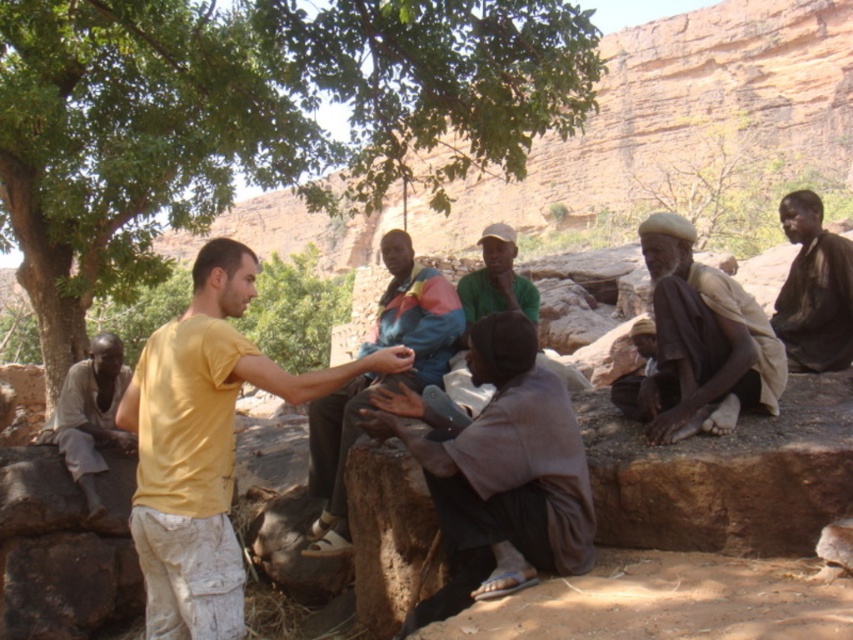
Is multicolored fabric at center thinner than dark brown fabric at right?

Incorrect, multicolored fabric at center's width is not less than dark brown fabric at right's.

In order to click on multicolored fabric at center in this screenshot , I will do `click(379, 378)`.

Is brown woven cloth at lower right to the left of green fabric cap at center from the viewer's perspective?

No, brown woven cloth at lower right is not to the left of green fabric cap at center.

Can you confirm if brown woven cloth at lower right is thinner than green fabric cap at center?

In fact, brown woven cloth at lower right might be wider than green fabric cap at center.

Where is `brown woven cloth at lower right`? This screenshot has height=640, width=853. brown woven cloth at lower right is located at coordinates (701, 340).

The height and width of the screenshot is (640, 853). I want to click on brown woven cloth at lower right, so (x=701, y=340).

Between green leafy tree at upper left and multicolored fabric at center, which one is positioned higher?

Positioned higher is green leafy tree at upper left.

Which of these two, green leafy tree at upper left or multicolored fabric at center, stands shorter?

With less height is multicolored fabric at center.

Which is behind, point (47, 68) or point (310, 556)?

The point (47, 68) is more distant.

Image resolution: width=853 pixels, height=640 pixels. Identify the location of green leafy tree at upper left. pos(252,118).